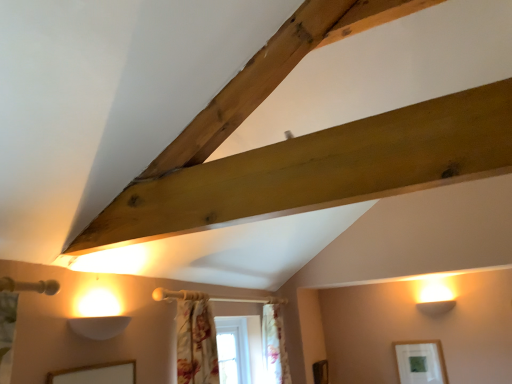
Question: From the image's perspective, would you say floral fabric curtain at center, the 2th curtain positioned from the front, is positioned over matte white picture frame at lower right?

Choices:
 (A) no
 (B) yes

Answer: (B)

Question: Considering the relative positions of floral fabric curtain at center, the 2th curtain positioned from the front, and matte white picture frame at lower right in the image provided, is floral fabric curtain at center, the 2th curtain positioned from the front, to the left of matte white picture frame at lower right from the viewer's perspective?

Choices:
 (A) yes
 (B) no

Answer: (A)

Question: Is floral fabric curtain at center, which is the 1th curtain in back-to-front order, positioned with its back to matte white picture frame at lower right?

Choices:
 (A) no
 (B) yes

Answer: (A)

Question: Is floral fabric curtain at center, which ranks as the 1th curtain in right-to-left order, shorter than matte white picture frame at lower right?

Choices:
 (A) yes
 (B) no

Answer: (B)

Question: Does floral fabric curtain at center, the second curtain when ordered from left to right, contain matte white picture frame at lower right?

Choices:
 (A) no
 (B) yes

Answer: (A)

Question: Is point (281, 370) closer or farther from the camera than point (220, 357)?

Choices:
 (A) closer
 (B) farther

Answer: (B)

Question: In the image, is floral fabric curtain at center, the 2th curtain positioned from the front, on the left side or the right side of white painted wood window at center?

Choices:
 (A) left
 (B) right

Answer: (B)

Question: Is floral fabric curtain at center, the second curtain when ordered from left to right, inside or outside of white painted wood window at center?

Choices:
 (A) outside
 (B) inside

Answer: (A)

Question: Considering their positions, is floral fabric curtain at center, which is the 1th curtain in back-to-front order, located in front of or behind white painted wood window at center?

Choices:
 (A) front
 (B) behind

Answer: (B)

Question: From the image's perspective, relative to matte white picture frame at lower right, is white painted wood window at center above or below?

Choices:
 (A) below
 (B) above

Answer: (B)

Question: Do you think white painted wood window at center is within matte white picture frame at lower right, or outside of it?

Choices:
 (A) inside
 (B) outside

Answer: (B)

Question: In terms of height, does white painted wood window at center look taller or shorter compared to matte white picture frame at lower right?

Choices:
 (A) tall
 (B) short

Answer: (A)

Question: Considering the positions of white painted wood window at center and matte white picture frame at lower right in the image, is white painted wood window at center bigger or smaller than matte white picture frame at lower right?

Choices:
 (A) small
 (B) big

Answer: (B)

Question: From a real-world perspective, is floral fabric curtain at center, the second curtain when ordered from left to right, physically located above or below matte white picture frame at lower right?

Choices:
 (A) below
 (B) above

Answer: (B)

Question: Is floral fabric curtain at center, which ranks as the 1th curtain in right-to-left order, situated inside matte white picture frame at lower right or outside?

Choices:
 (A) inside
 (B) outside

Answer: (B)